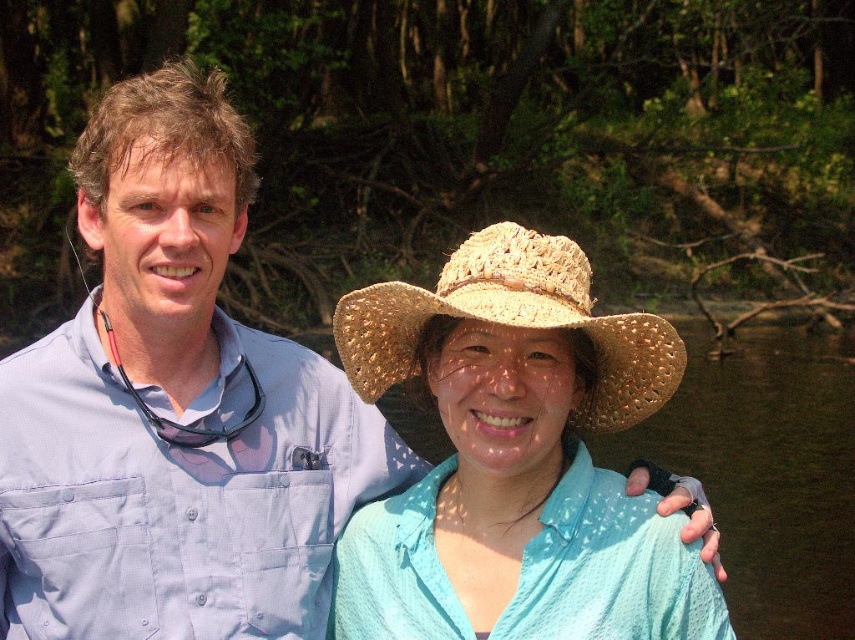
Does woven straw hat at center have a greater height compared to straw woven hat at center?

Yes, woven straw hat at center is taller than straw woven hat at center.

I want to click on woven straw hat at center, so click(x=516, y=460).